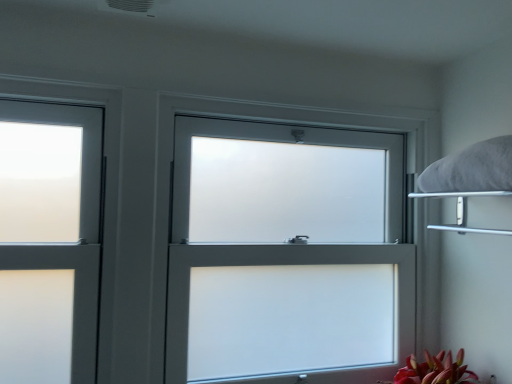
Find the location of `metallic silver shelf at upper right`. metallic silver shelf at upper right is located at coordinates (463, 211).

Find the location of `metallic silver shelf at upper right`. metallic silver shelf at upper right is located at coordinates (463, 211).

Considering the relative sizes of white fluffy pillow at upper right and metallic silver shelf at upper right in the image provided, is white fluffy pillow at upper right bigger than metallic silver shelf at upper right?

Actually, white fluffy pillow at upper right might be smaller than metallic silver shelf at upper right.

Does white fluffy pillow at upper right appear on the left side of metallic silver shelf at upper right?

No.

Considering the relative sizes of white fluffy pillow at upper right and metallic silver shelf at upper right in the image provided, is white fluffy pillow at upper right wider than metallic silver shelf at upper right?

Yes.

Looking at this image, based on their sizes in the image, would you say metallic silver shelf at upper right is bigger or smaller than white fluffy pillow at upper right?

metallic silver shelf at upper right is bigger than white fluffy pillow at upper right.

From a real-world perspective, is metallic silver shelf at upper right physically located above or below white fluffy pillow at upper right?

From a real-world perspective, metallic silver shelf at upper right is physically below white fluffy pillow at upper right.

Is metallic silver shelf at upper right next to white fluffy pillow at upper right?

Indeed, metallic silver shelf at upper right and white fluffy pillow at upper right are beside each other and touching.

How different are the orientations of metallic silver shelf at upper right and white fluffy pillow at upper right in degrees?

metallic silver shelf at upper right and white fluffy pillow at upper right are facing 0.008 degrees away from each other.

Is metallic silver shelf at upper right beside white frosted glass window at center?

metallic silver shelf at upper right is not next to white frosted glass window at center, and they're not touching.

Is metallic silver shelf at upper right positioned with its back to white frosted glass window at center?

No, metallic silver shelf at upper right is not facing away from white frosted glass window at center.

Which object is thinner, metallic silver shelf at upper right or white frosted glass window at center?

white frosted glass window at center.

From a real-world perspective, is metallic silver shelf at upper right positioned above or below white frosted glass window at center?

metallic silver shelf at upper right is situated higher than white frosted glass window at center in the real world.

Is the surface of white frosted glass window at center in direct contact with white fluffy pillow at upper right?

No, white frosted glass window at center is not beside white fluffy pillow at upper right.

Which object is closer to the camera taking this photo, white frosted glass window at center or white fluffy pillow at upper right?

white fluffy pillow at upper right is more forward.

From a real-world perspective, which object stands above the other?

From a 3D spatial view, white fluffy pillow at upper right is above.

Which of these two, white frosted glass window at center or white fluffy pillow at upper right, is smaller?

With smaller size is white fluffy pillow at upper right.

Measure the distance from white frosted glass window at center to metallic silver shelf at upper right.

51.76 centimeters.

Can you confirm if white frosted glass window at center is shorter than metallic silver shelf at upper right?

In fact, white frosted glass window at center may be taller than metallic silver shelf at upper right.

Is white frosted glass window at center located outside metallic silver shelf at upper right?

Yes.

Between point (194, 107) and point (459, 229), which one is positioned behind?

The point (459, 229) is farther.

Considering the relative sizes of white fluffy pillow at upper right and white frosted glass window at center in the image provided, is white fluffy pillow at upper right wider than white frosted glass window at center?

Indeed, white fluffy pillow at upper right has a greater width compared to white frosted glass window at center.

Would you say white frosted glass window at center is part of white fluffy pillow at upper right's contents?

No, white frosted glass window at center is located outside of white fluffy pillow at upper right.

Which object is further away from the camera, white fluffy pillow at upper right or white frosted glass window at center?

white frosted glass window at center is further from the camera.

Are white fluffy pillow at upper right and white frosted glass window at center beside each other?

No, white fluffy pillow at upper right is not touching white frosted glass window at center.

Image resolution: width=512 pixels, height=384 pixels. Find the location of `bed above the metallic silver shelf at upper right (from a real-world perspective)`. bed above the metallic silver shelf at upper right (from a real-world perspective) is located at coordinates (470, 179).

This screenshot has height=384, width=512. In order to click on shelf that appears behind the white fluffy pillow at upper right in this screenshot , I will do `click(463, 211)`.

From the image, which object appears to be nearer to metallic silver shelf at upper right, white frosted glass window at center or white fluffy pillow at upper right?

Among the two, white fluffy pillow at upper right is located nearer to metallic silver shelf at upper right.

When comparing their distances from metallic silver shelf at upper right, does white fluffy pillow at upper right or white frosted glass window at center seem closer?

white fluffy pillow at upper right.

Consider the image. Which object lies nearer to the anchor point white fluffy pillow at upper right, metallic silver shelf at upper right or white frosted glass window at center?

metallic silver shelf at upper right is closer to white fluffy pillow at upper right.

Considering their positions, is white fluffy pillow at upper right positioned closer to white frosted glass window at center than metallic silver shelf at upper right?

white fluffy pillow at upper right is closer to white frosted glass window at center.

Considering their positions, is white frosted glass window at center positioned further to white fluffy pillow at upper right than metallic silver shelf at upper right?

Based on the image, white frosted glass window at center appears to be further to white fluffy pillow at upper right.

From the image, which object appears to be nearer to white frosted glass window at center, metallic silver shelf at upper right or white fluffy pillow at upper right?

white fluffy pillow at upper right is positioned closer to the anchor white frosted glass window at center.

Image resolution: width=512 pixels, height=384 pixels. Find the location of `shelf located between white frosted glass window at center and white fluffy pillow at upper right in the left-right direction`. shelf located between white frosted glass window at center and white fluffy pillow at upper right in the left-right direction is located at coordinates (463, 211).